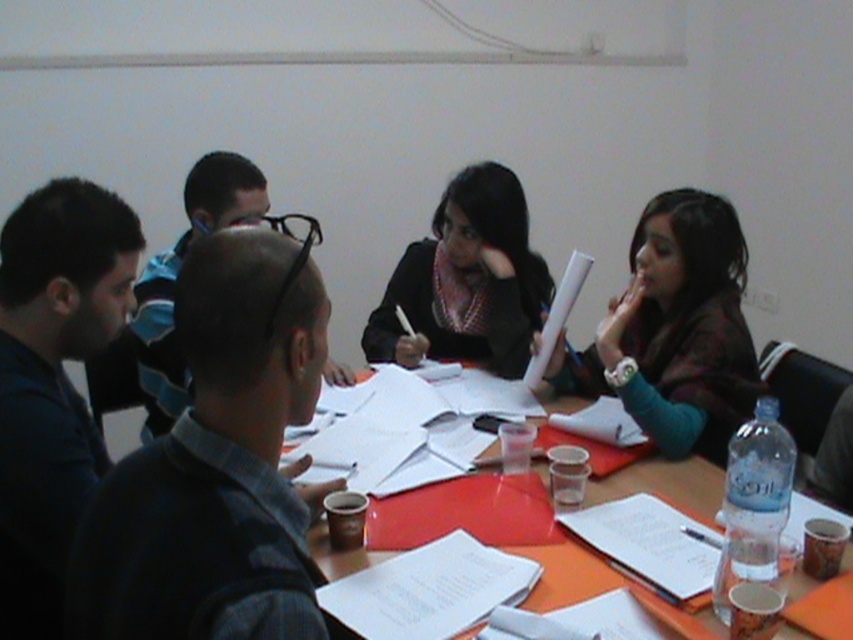
Between point (498, 292) and point (689, 509), which one is positioned in front?

Point (689, 509) is in front.

Can you confirm if matte black jacket at center is thinner than wooden table at center?

Correct, matte black jacket at center's width is less than wooden table at center's.

Is point (489, 253) behind point (599, 588)?

Yes, it is.

Find the location of a particular element. matte black jacket at center is located at coordinates (466, 280).

Who is positioned more to the left, matte brown jacket at upper right or matte black jacket at center?

From the viewer's perspective, matte black jacket at center appears more on the left side.

Is matte brown jacket at upper right smaller than matte black jacket at center?

Actually, matte brown jacket at upper right might be larger than matte black jacket at center.

Does point (677, 440) come farther from viewer compared to point (384, 307)?

No, (677, 440) is closer to viewer.

Find the location of `matte brown jacket at upper right`. matte brown jacket at upper right is located at coordinates click(x=675, y=330).

Looking at this image, is matte brown jacket at upper right to the left of wooden table at center from the viewer's perspective?

Incorrect, matte brown jacket at upper right is not on the left side of wooden table at center.

Is matte brown jacket at upper right wider than wooden table at center?

No.

At what (x,y) coordinates should I click in order to perform the action: click on matte brown jacket at upper right. Please return your answer as a coordinate pair (x, y). Looking at the image, I should click on (675, 330).